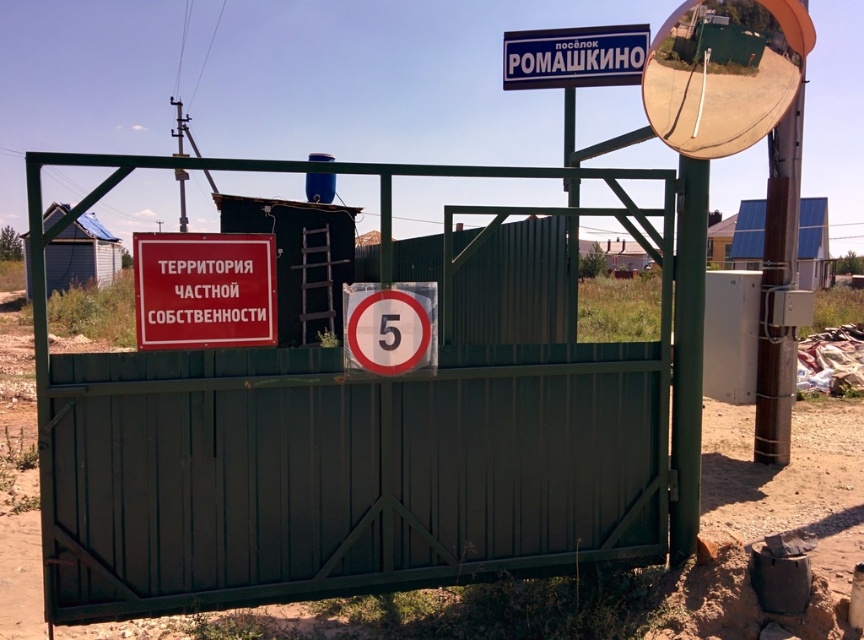
Question: Is red matte sign at center positioned in front of blue plastic signboard at upper center?

Choices:
 (A) no
 (B) yes

Answer: (B)

Question: Estimate the real-world distances between objects in this image. Which object is closer to the blue plastic signboard at upper center?

Choices:
 (A) green painted metal gate at center
 (B) red matte sign at center

Answer: (A)

Question: Is red matte sign at center wider than blue plastic signboard at upper center?

Choices:
 (A) no
 (B) yes

Answer: (A)

Question: Does green painted metal gate at center appear on the left side of blue plastic signboard at upper center?

Choices:
 (A) yes
 (B) no

Answer: (A)

Question: Which point is farther to the camera?

Choices:
 (A) green painted metal gate at center
 (B) red matte sign at center
 (C) blue plastic signboard at upper center

Answer: (C)

Question: Considering the real-world distances, which object is farthest from the green painted metal gate at center?

Choices:
 (A) red matte sign at center
 (B) blue plastic signboard at upper center

Answer: (B)